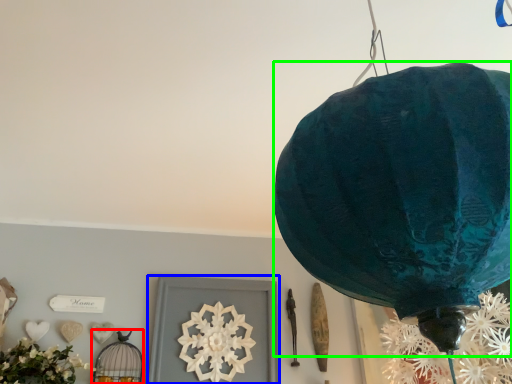
Question: Which object is positioned closest to lamp (highlighted by a red box)? Select from picture frame (highlighted by a blue box) and lantern (highlighted by a green box).

Choices:
 (A) picture frame
 (B) lantern

Answer: (A)